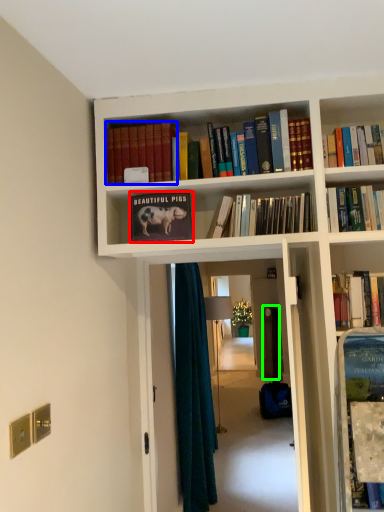
Question: Which object is positioned closest to book (highlighted by a red box)? Select from book (highlighted by a blue box) and door (highlighted by a green box).

Choices:
 (A) book
 (B) door

Answer: (A)